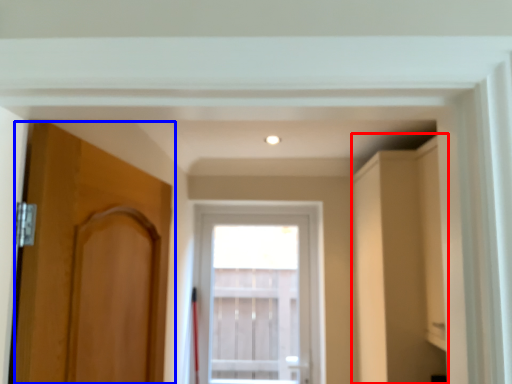
Question: Which point is further to the camera, cabinetry (highlighted by a red box) or door (highlighted by a blue box)?

Choices:
 (A) cabinetry
 (B) door

Answer: (A)